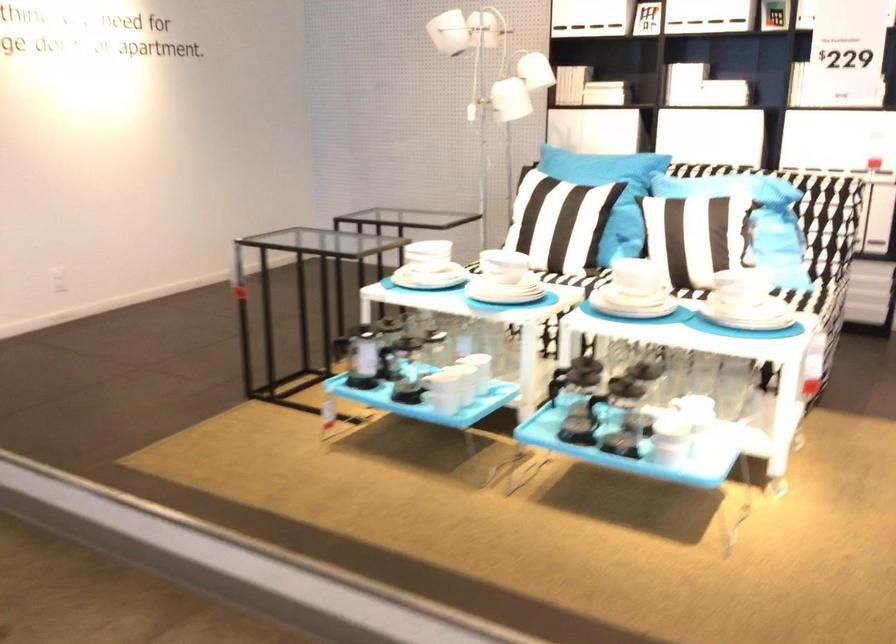
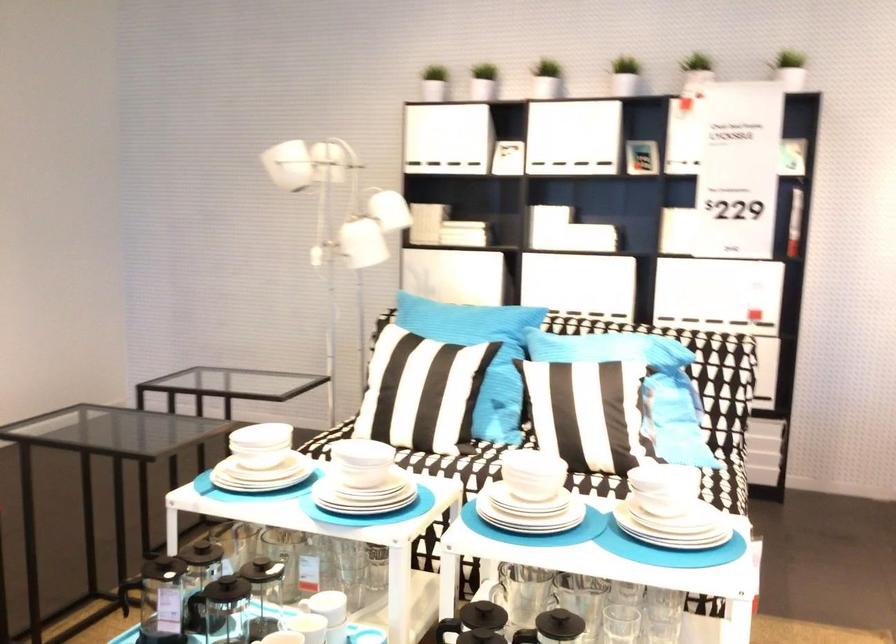
Find the pixel in the second image that matches point (426, 251) in the first image.

(261, 440)